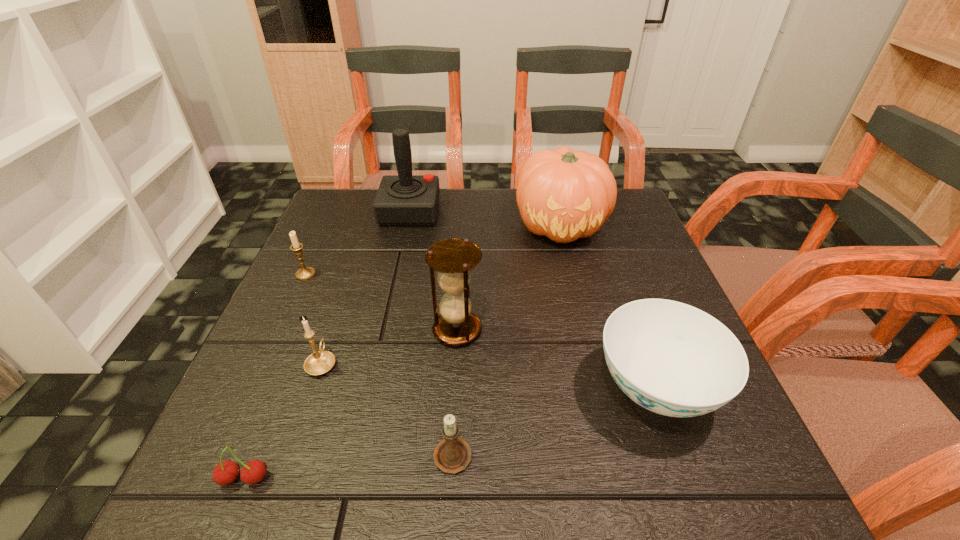
The width and height of the screenshot is (960, 540). What are the coordinates of `object positioned at the far right corner` in the screenshot? It's located at (564, 195).

In the image, there is a desktop. Find the location of `vacant space at the far edge`. vacant space at the far edge is located at coordinates (474, 215).

The image size is (960, 540). In order to click on vacant space at the near edge in this screenshot , I will do `click(540, 469)`.

I want to click on free point at the left edge, so click(316, 424).

Locate an element on the screen. This screenshot has width=960, height=540. free location at the right edge is located at coordinates (684, 443).

This screenshot has width=960, height=540. In the image, there is a desktop. Identify the location of vacant space at the far left corner. (374, 230).

Where is `vacant area at the near right corner`? This screenshot has height=540, width=960. vacant area at the near right corner is located at coordinates (777, 501).

The image size is (960, 540). I want to click on vacant area that lies between the joystick and the cherry, so point(327,345).

Where is `empty space between the hourglass and the third farthest object`? The height and width of the screenshot is (540, 960). empty space between the hourglass and the third farthest object is located at coordinates (381, 302).

Image resolution: width=960 pixels, height=540 pixels. I want to click on vacant space that is in between the leftmost candle holder and the joystick, so click(x=357, y=242).